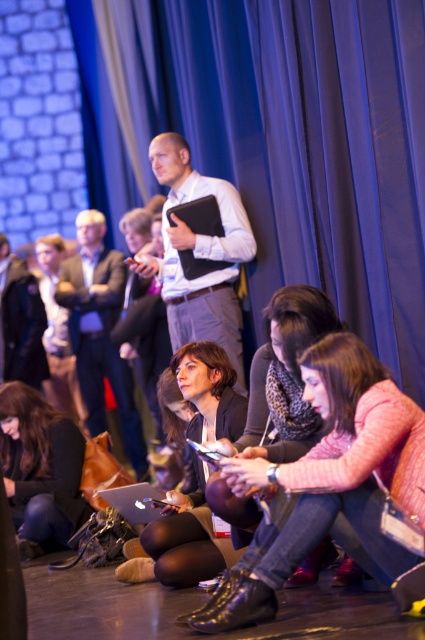
Question: Among these points, which one is nearest to the camera?

Choices:
 (A) (172, 234)
 (B) (8, 472)
 (C) (320, 308)
 (D) (418, 460)

Answer: (D)

Question: Can you confirm if pink matte sweater at lower center is bigger than light brown leather jacket at center?

Choices:
 (A) yes
 (B) no

Answer: (B)

Question: Estimate the real-world distances between objects in this image. Which object is farther from the pink matte sweater at lower center?

Choices:
 (A) light brown leather jacket at center
 (B) white glossy shirt at center

Answer: (A)

Question: Is blue fabric curtain at upper center bigger than matte black laptop at center?

Choices:
 (A) no
 (B) yes

Answer: (B)

Question: Among these points, which one is nearest to the camera?

Choices:
 (A) (312, 369)
 (B) (201, 237)

Answer: (A)

Question: Is pink matte sweater at lower center to the left of matte black jacket at center from the viewer's perspective?

Choices:
 (A) yes
 (B) no

Answer: (B)